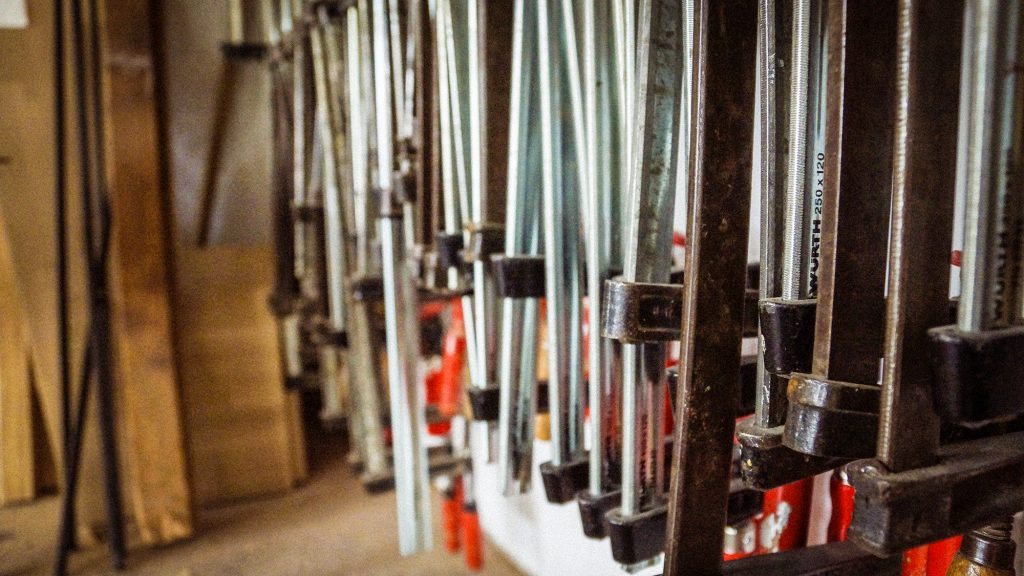
Find the location of a particular element. The height and width of the screenshot is (576, 1024). floor is located at coordinates (338, 536).